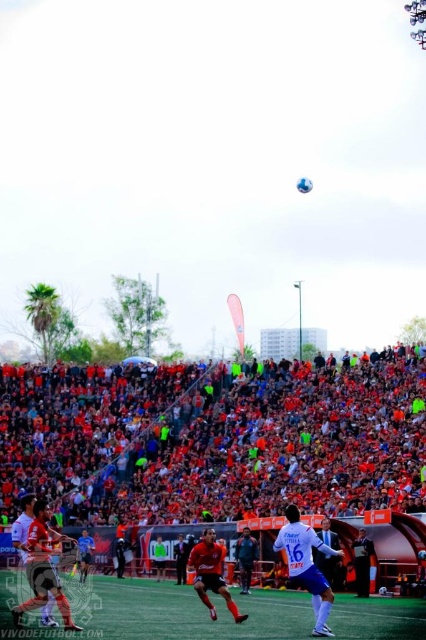
Question: Which point is closer to the camera?

Choices:
 (A) (83, 500)
 (B) (155, 589)
 (C) (331, 550)

Answer: (C)

Question: Which of the following is the closest to the observer?

Choices:
 (A) white matte jersey at center
 (B) green artificial turf at center
 (C) orange fabric crowd at center

Answer: (B)

Question: Which object is farther from the camera taking this photo?

Choices:
 (A) white matte jersey at center
 (B) orange fabric crowd at center
 (C) green artificial turf at center

Answer: (B)

Question: From the image, what is the correct spatial relationship of orange fabric crowd at center in relation to green artificial turf at center?

Choices:
 (A) left
 (B) right

Answer: (B)

Question: Is orange fabric crowd at center below white matte jersey at center?

Choices:
 (A) no
 (B) yes

Answer: (A)

Question: Does orange fabric crowd at center lie in front of white matte jersey at center?

Choices:
 (A) no
 (B) yes

Answer: (A)